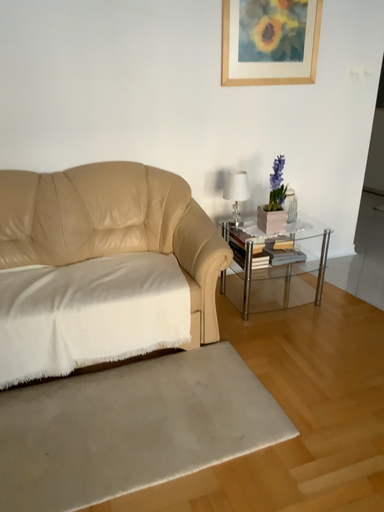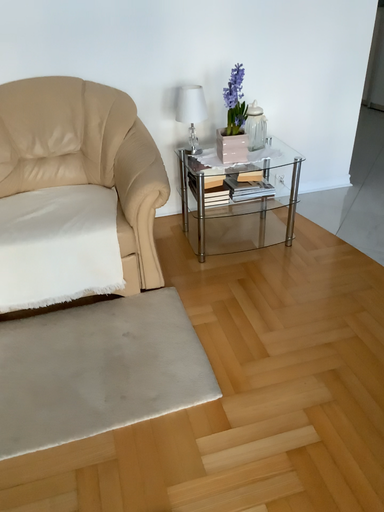
Question: Which way did the camera rotate in the video?

Choices:
 (A) rotated downward
 (B) rotated upward

Answer: (A)